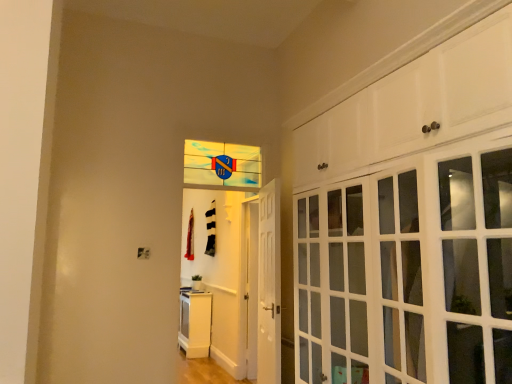
Question: Does white glossy cabinet doors at upper right, which appears as the 2th cabinetry when viewed from the left, appear on the left side of white glossy door at center?

Choices:
 (A) yes
 (B) no

Answer: (B)

Question: Does white glossy cabinet doors at upper right, which appears as the 2th cabinetry when viewed from the left, have a smaller size compared to white glossy door at center?

Choices:
 (A) yes
 (B) no

Answer: (B)

Question: From a real-world perspective, is white glossy cabinet doors at upper right, placed as the first cabinetry when sorted from right to left, over white glossy door at center?

Choices:
 (A) yes
 (B) no

Answer: (A)

Question: Is white glossy cabinet doors at upper right, which is counted as the second cabinetry, starting from the bottom, oriented towards white glossy door at center?

Choices:
 (A) no
 (B) yes

Answer: (A)

Question: Is white glossy cabinet doors at upper right, marked as the 1th cabinetry in a front-to-back arrangement, not close to white glossy door at center?

Choices:
 (A) no
 (B) yes

Answer: (B)

Question: From the image's perspective, is white glossy cabinet doors at upper right, the 2th cabinetry from the back, under white glossy door at center?

Choices:
 (A) no
 (B) yes

Answer: (A)

Question: From the image's perspective, does white glossy door at center appear lower than translucent glass window at center?

Choices:
 (A) yes
 (B) no

Answer: (A)

Question: Considering the relative positions of white glossy door at center and translucent glass window at center in the image provided, is white glossy door at center to the right of translucent glass window at center from the viewer's perspective?

Choices:
 (A) yes
 (B) no

Answer: (A)

Question: Is white glossy door at center closer to the viewer compared to translucent glass window at center?

Choices:
 (A) no
 (B) yes

Answer: (B)

Question: Is white glossy door at center oriented away from translucent glass window at center?

Choices:
 (A) yes
 (B) no

Answer: (B)

Question: Can you confirm if white glossy door at center is wider than translucent glass window at center?

Choices:
 (A) yes
 (B) no

Answer: (A)

Question: Would you say translucent glass window at center is part of white glossy door at center's contents?

Choices:
 (A) yes
 (B) no

Answer: (B)

Question: Does white glossy cabinet at lower left, which is the first cabinetry in left-to-right order, have a greater width compared to white glossy door at center?

Choices:
 (A) no
 (B) yes

Answer: (B)